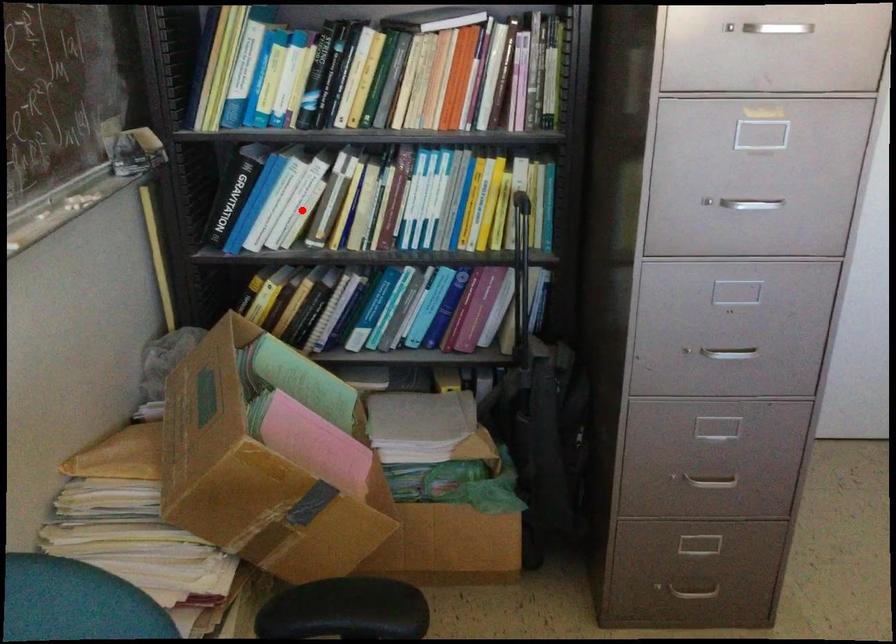
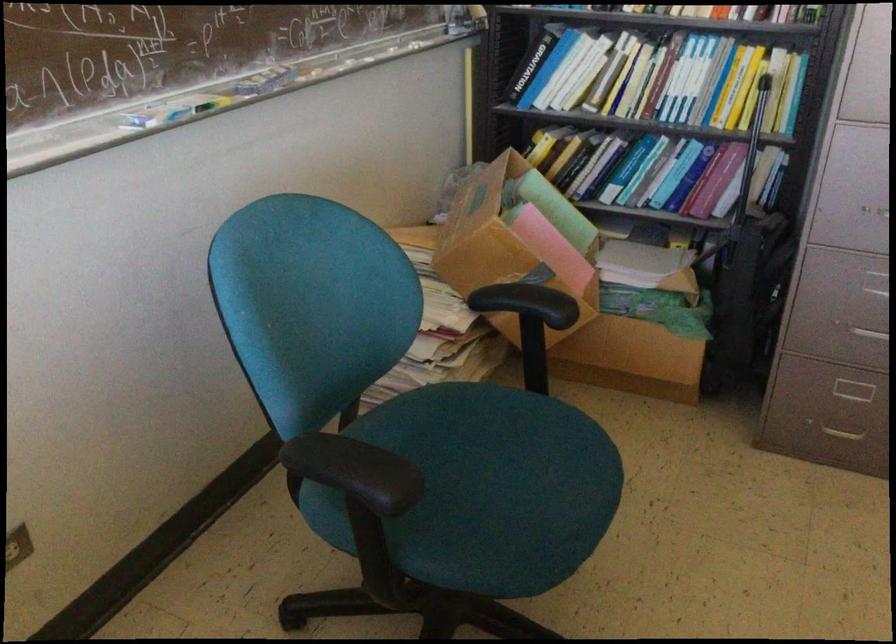
Question: I am providing you with two images of the same scene from different viewpoints. Image1 has a red point marked. In image2, the corresponding 3D location appears at what relative position? Reply with the corresponding letter.

Choices:
 (A) Closer
 (B) Farther

Answer: (B)